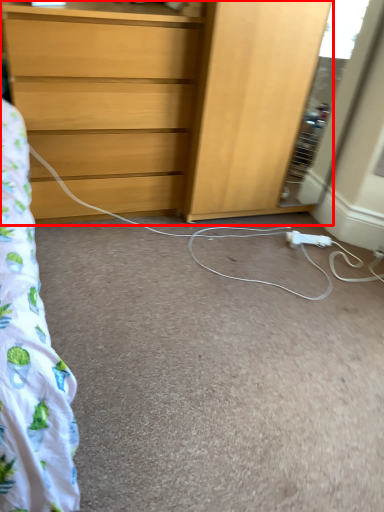
Question: From the image's perspective, where is chest of drawers (annotated by the red box) located in relation to extension cord in the image?

Choices:
 (A) above
 (B) below

Answer: (A)